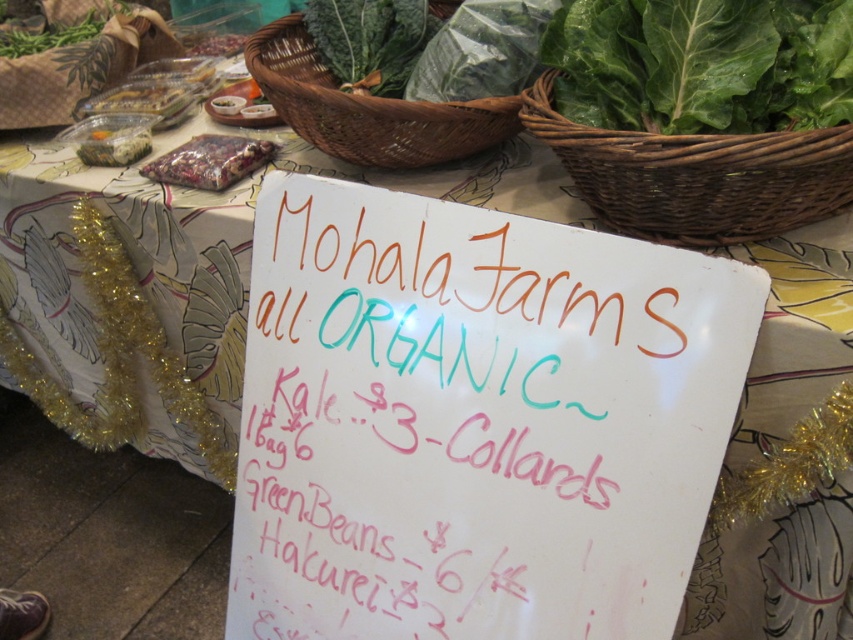
You are standing at the market stall and want to read the sign. Can you comfortably read the white paper sign at center from your current position?

The white paper sign at center is 31.13 inches away from the viewer, so yes, you can comfortably read it from your current position.

You are standing at the market stall and want to determine which of the two points, point [503,554] or point [543,106], is closer to you. Which one is closer?

Point [503,554] is closer to the viewer than point [543,106].